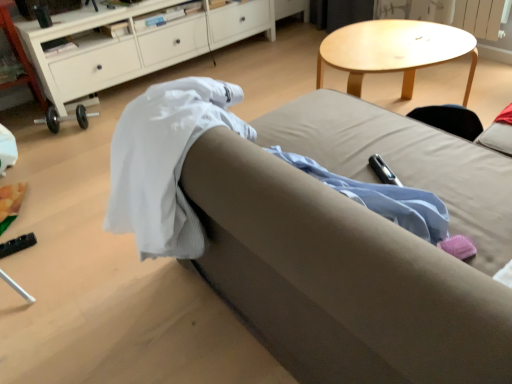
Question: Does light brown fabric couch at center have a lesser height compared to white wood cabinet at upper left?

Choices:
 (A) no
 (B) yes

Answer: (A)

Question: Is light brown fabric couch at center oriented towards white wood cabinet at upper left?

Choices:
 (A) yes
 (B) no

Answer: (B)

Question: From the image's perspective, does light brown fabric couch at center appear higher than white wood cabinet at upper left?

Choices:
 (A) no
 (B) yes

Answer: (A)

Question: Is light brown fabric couch at center positioned in front of white wood cabinet at upper left?

Choices:
 (A) no
 (B) yes

Answer: (B)

Question: Is light brown fabric couch at center far away from white wood cabinet at upper left?

Choices:
 (A) yes
 (B) no

Answer: (A)

Question: Is white wood cabinet at upper left located within light brown fabric couch at center?

Choices:
 (A) no
 (B) yes

Answer: (A)

Question: Is white wood cabinet at upper left located outside light brown fabric couch at center?

Choices:
 (A) no
 (B) yes

Answer: (B)

Question: Is white wood cabinet at upper left looking in the opposite direction of light brown fabric couch at center?

Choices:
 (A) yes
 (B) no

Answer: (B)

Question: From the image's perspective, is white wood cabinet at upper left beneath light brown fabric couch at center?

Choices:
 (A) no
 (B) yes

Answer: (A)

Question: Is white wood cabinet at upper left directly adjacent to light brown fabric couch at center?

Choices:
 (A) yes
 (B) no

Answer: (B)

Question: From a real-world perspective, is white wood cabinet at upper left below light brown fabric couch at center?

Choices:
 (A) no
 (B) yes

Answer: (B)

Question: Is white wood cabinet at upper left smaller than light brown fabric couch at center?

Choices:
 (A) no
 (B) yes

Answer: (B)

Question: From a real-world perspective, is light brown fabric couch at center positioned above or below white wood cabinet at upper left?

Choices:
 (A) above
 (B) below

Answer: (A)